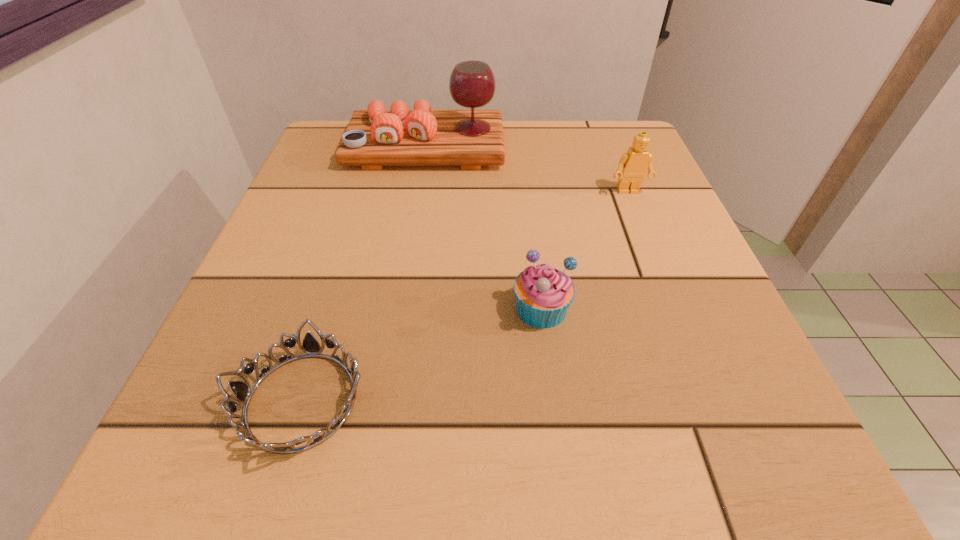
At what (x,y) coordinates should I click in order to perform the action: click on the farthest object. Please return your answer as a coordinate pair (x, y). Looking at the image, I should click on (375, 137).

Where is `the tallest object`? The height and width of the screenshot is (540, 960). the tallest object is located at coordinates (375, 137).

You are a GUI agent. You are given a task and a screenshot of the screen. Output one action in this format:
    pyautogui.click(x=<x>, y=<y>)
    Task: Click on the Lego
    This screenshot has width=960, height=540.
    Given the screenshot: What is the action you would take?
    pyautogui.click(x=633, y=165)

Image resolution: width=960 pixels, height=540 pixels. What are the coordinates of `the third shortest object` in the screenshot? It's located at (633, 165).

Identify the location of muffin. The width and height of the screenshot is (960, 540). (543, 293).

I want to click on the second nearest object, so click(543, 293).

Identify the location of tiara. The height and width of the screenshot is (540, 960). (242, 391).

Identify the location of the nearest object. (x=242, y=391).

Image resolution: width=960 pixels, height=540 pixels. I want to click on free spot located on the right of the tallest object, so click(639, 147).

Identify the location of vacant space located on the face of the third nearest object. (654, 255).